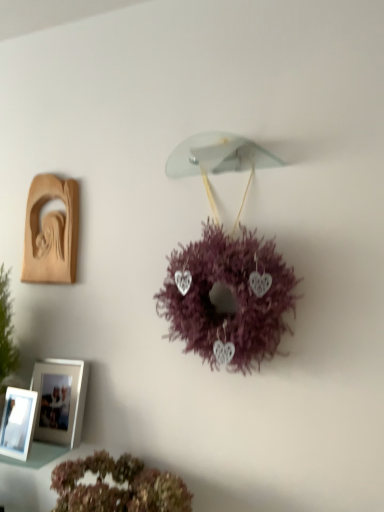
Question: Is purple fluffy wreath at center, the second flower positioned from the bottom, to the right of wooden carving at left, which ranks as the first picture frame in top-to-bottom order, from the viewer's perspective?

Choices:
 (A) yes
 (B) no

Answer: (A)

Question: From the image's perspective, is purple fluffy wreath at center, the second flower positioned from the bottom, on top of wooden carving at left, which appears as the third picture frame when ordered from the bottom?

Choices:
 (A) no
 (B) yes

Answer: (A)

Question: Are purple fluffy wreath at center, the second flower positioned from the bottom, and wooden carving at left, which ranks as the first picture frame in top-to-bottom order, far apart?

Choices:
 (A) yes
 (B) no

Answer: (B)

Question: Does purple fluffy wreath at center, the 1th flower in the top-to-bottom sequence, have a lesser height compared to wooden carving at left, which ranks as the first picture frame in top-to-bottom order?

Choices:
 (A) no
 (B) yes

Answer: (A)

Question: Is purple fluffy wreath at center, the 1th flower in the top-to-bottom sequence, not inside wooden carving at left, which appears as the third picture frame when ordered from the bottom?

Choices:
 (A) no
 (B) yes

Answer: (B)

Question: Is purple fluffy wreath at center, the second flower positioned from the bottom, facing away from wooden carving at left, which appears as the third picture frame when ordered from the bottom?

Choices:
 (A) no
 (B) yes

Answer: (A)

Question: Considering the relative positions of fluffy pink wreath at lower center, the 1th flower from the bottom, and purple fluffy wreath at center, the 1th flower in the top-to-bottom sequence, in the image provided, is fluffy pink wreath at lower center, the 1th flower from the bottom, to the left of purple fluffy wreath at center, the 1th flower in the top-to-bottom sequence, from the viewer's perspective?

Choices:
 (A) no
 (B) yes

Answer: (B)

Question: Is fluffy pink wreath at lower center, which ranks as the second flower in top-to-bottom order, far away from purple fluffy wreath at center, the second flower positioned from the bottom?

Choices:
 (A) yes
 (B) no

Answer: (B)

Question: Considering the relative positions of fluffy pink wreath at lower center, the 1th flower from the bottom, and purple fluffy wreath at center, the second flower positioned from the bottom, in the image provided, is fluffy pink wreath at lower center, the 1th flower from the bottom, to the right of purple fluffy wreath at center, the second flower positioned from the bottom, from the viewer's perspective?

Choices:
 (A) no
 (B) yes

Answer: (A)

Question: Considering the relative sizes of fluffy pink wreath at lower center, the 1th flower from the bottom, and purple fluffy wreath at center, the second flower positioned from the bottom, in the image provided, is fluffy pink wreath at lower center, the 1th flower from the bottom, shorter than purple fluffy wreath at center, the second flower positioned from the bottom,?

Choices:
 (A) yes
 (B) no

Answer: (A)

Question: From a real-world perspective, is fluffy pink wreath at lower center, the 1th flower from the bottom, located higher than purple fluffy wreath at center, the 1th flower in the top-to-bottom sequence?

Choices:
 (A) no
 (B) yes

Answer: (A)

Question: From a real-world perspective, is fluffy pink wreath at lower center, the 1th flower from the bottom, positioned under purple fluffy wreath at center, the 1th flower in the top-to-bottom sequence, based on gravity?

Choices:
 (A) no
 (B) yes

Answer: (B)

Question: Is white glossy picture frame at lower left, which is counted as the second picture frame, starting from the bottom, to the right of wooden carving at left, which ranks as the first picture frame in top-to-bottom order, from the viewer's perspective?

Choices:
 (A) yes
 (B) no

Answer: (A)